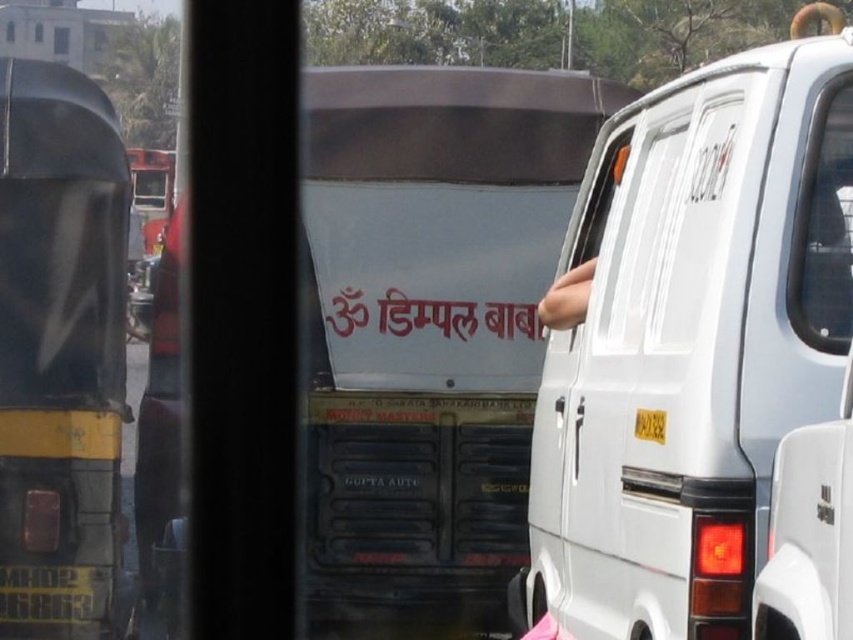
You are a delivery driver trying to navigate through the street. You see the white matte van at center and the yellow metallic license plate at lower left. Which object is closer to you as you look at the scene?

The white matte van at center is closer to you because it is in front of the yellow metallic license plate at lower left.

You are a pedestrian standing in the middle of the street. You see a white matte van at center and a yellow matte truck at left. Which vehicle is nearer to you?

The white matte van at center is closer to the viewer than the yellow matte truck at left, so the white matte van at center is nearer to you.

You are a delivery person standing at the edge of the street. You need to locate the white matte van at center. According to the map, the van is at coordinates 0.533 on the x axis and 0.810 on the y axis. If the map uses a coordinate system where the bottom left corner is the origin, which direction should you walk to reach the van?

Since the white matte van at center is located at coordinates x 0.533 and y 0.810, and the origin is at the bottom left corner, you should walk towards the upper right direction to reach the van.